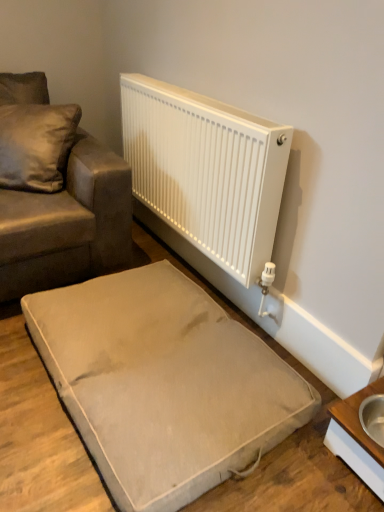
What do you see at coordinates (163, 383) in the screenshot? This screenshot has height=512, width=384. I see `beige fabric dog bed at lower center` at bounding box center [163, 383].

Locate an element on the screen. satin brown couch at upper left is located at coordinates (67, 223).

You are a GUI agent. You are given a task and a screenshot of the screen. Output one action in this format:
    pyautogui.click(x=<x>, y=<y>)
    Task: Click on the satin cushion at upper left
    The width and height of the screenshot is (384, 512).
    Given the screenshot: What is the action you would take?
    pyautogui.click(x=36, y=145)

At what (x,y) coordinates should I click in order to perform the action: click on white wood table at lower right. Please return your answer as a coordinate pair (x, y). Looking at the image, I should click on (357, 439).

From the image's perspective, is satin brown couch at upper left located above or below white wood table at lower right?

Based on their image positions, satin brown couch at upper left is located above white wood table at lower right.

From a real-world perspective, who is located lower, satin brown couch at upper left or white wood table at lower right?

white wood table at lower right is physically lower.

Is satin brown couch at upper left beside white wood table at lower right?

No, satin brown couch at upper left is not touching white wood table at lower right.

Do you think satin brown couch at upper left is within white wood table at lower right, or outside of it?

satin brown couch at upper left is not enclosed by white wood table at lower right.

In the scene shown: Is satin brown couch at upper left positioned with its back to satin cushion at upper left?

Yes, satin brown couch at upper left is positioned with its back facing satin cushion at upper left.

Between satin brown couch at upper left and satin cushion at upper left, which one appears on the left side from the viewer's perspective?

satin cushion at upper left.

Which object is closer to the camera, satin brown couch at upper left or satin cushion at upper left?

satin brown couch at upper left is in front.

Are satin brown couch at upper left and satin cushion at upper left far apart?

No, satin brown couch at upper left is in close proximity to satin cushion at upper left.

Who is bigger, white wood table at lower right or satin cushion at upper left?

With larger size is satin cushion at upper left.

Considering the sizes of objects white wood table at lower right and satin cushion at upper left in the image provided, who is thinner, white wood table at lower right or satin cushion at upper left?

white wood table at lower right.

Is white wood table at lower right far from satin cushion at upper left?

Yes, white wood table at lower right is far from satin cushion at upper left.

Considering the positions of points (365, 476) and (15, 137), is point (365, 476) farther from camera compared to point (15, 137)?

No, it is not.

Which of these two, beige fabric dog bed at lower center or satin brown couch at upper left, stands shorter?

beige fabric dog bed at lower center.

Is beige fabric dog bed at lower center facing towards satin brown couch at upper left?

No, beige fabric dog bed at lower center is not oriented towards satin brown couch at upper left.

Which object is wider, beige fabric dog bed at lower center or satin brown couch at upper left?

satin brown couch at upper left is wider.

Does satin brown couch at upper left touch beige fabric dog bed at lower center?

satin brown couch at upper left and beige fabric dog bed at lower center are clearly separated.

What's the angular difference between satin brown couch at upper left and beige fabric dog bed at lower center's facing directions?

The facing directions of satin brown couch at upper left and beige fabric dog bed at lower center are 87.4 degrees apart.

From a real-world perspective, which object rests below the other?

From a 3D spatial view, beige fabric dog bed at lower center is below.

Would you say beige fabric dog bed at lower center is inside or outside satin cushion at upper left?

beige fabric dog bed at lower center cannot be found inside satin cushion at upper left.

Does beige fabric dog bed at lower center have a larger size compared to satin cushion at upper left?

Yes.

Can you confirm if beige fabric dog bed at lower center is taller than satin cushion at upper left?

No.

Could you tell me if satin cushion at upper left is facing satin brown couch at upper left?

Yes, satin cushion at upper left is aimed at satin brown couch at upper left.

Would you say satin cushion at upper left is a long distance from satin brown couch at upper left?

No, there isn't a large distance between satin cushion at upper left and satin brown couch at upper left.

Considering the sizes of objects satin cushion at upper left and satin brown couch at upper left in the image provided, who is thinner, satin cushion at upper left or satin brown couch at upper left?

With smaller width is satin cushion at upper left.

Is satin cushion at upper left surrounding satin brown couch at upper left?

Actually, satin brown couch at upper left is outside satin cushion at upper left.

The width and height of the screenshot is (384, 512). What are the coordinates of `table lying on the right of satin brown couch at upper left` in the screenshot? It's located at (357, 439).

Where is `pillow above the satin brown couch at upper left (from a real-world perspective)`? pillow above the satin brown couch at upper left (from a real-world perspective) is located at coordinates (36, 145).

Based on their spatial positions, is white wood table at lower right or satin brown couch at upper left closer to beige fabric dog bed at lower center?

The object closer to beige fabric dog bed at lower center is white wood table at lower right.

Estimate the real-world distances between objects in this image. Which object is closer to white wood table at lower right, beige fabric dog bed at lower center or satin brown couch at upper left?

beige fabric dog bed at lower center is closer to white wood table at lower right.

When comparing their distances from satin cushion at upper left, does beige fabric dog bed at lower center or satin brown couch at upper left seem further?

beige fabric dog bed at lower center.

When comparing their distances from satin brown couch at upper left, does satin cushion at upper left or white wood table at lower right seem closer?

satin cushion at upper left.

Looking at the image, which one is located further to beige fabric dog bed at lower center, satin brown couch at upper left or white wood table at lower right?

The object further to beige fabric dog bed at lower center is satin brown couch at upper left.

When comparing their distances from white wood table at lower right, does satin brown couch at upper left or beige fabric dog bed at lower center seem closer?

beige fabric dog bed at lower center is closer to white wood table at lower right.

When comparing their distances from satin cushion at upper left, does satin brown couch at upper left or beige fabric dog bed at lower center seem closer?

satin brown couch at upper left is positioned closer to the anchor satin cushion at upper left.

Which object lies nearer to the anchor point beige fabric dog bed at lower center, satin cushion at upper left or satin brown couch at upper left?

Based on the image, satin brown couch at upper left appears to be nearer to beige fabric dog bed at lower center.

Find the location of `furniture located between satin brown couch at upper left and white wood table at lower right in the left-right direction`. furniture located between satin brown couch at upper left and white wood table at lower right in the left-right direction is located at coordinates (163, 383).

Find the location of `studio couch that lies between satin cushion at upper left and beige fabric dog bed at lower center from top to bottom`. studio couch that lies between satin cushion at upper left and beige fabric dog bed at lower center from top to bottom is located at coordinates (67, 223).

The height and width of the screenshot is (512, 384). In order to click on studio couch between satin cushion at upper left and white wood table at lower right from left to right in this screenshot , I will do `click(67, 223)`.

I want to click on furniture between satin cushion at upper left and white wood table at lower right in the horizontal direction, so click(x=163, y=383).